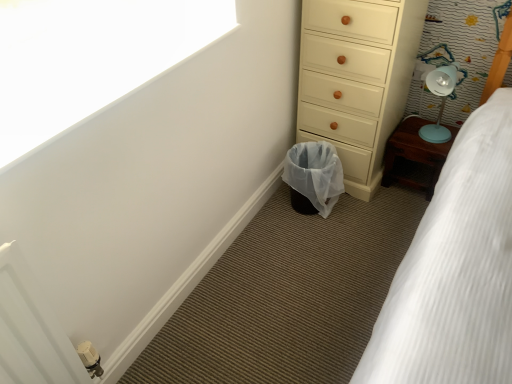
Question: Is white textured bed at lower right inside white matte window screen at upper left?

Choices:
 (A) no
 (B) yes

Answer: (A)

Question: Is white matte window screen at upper left wider than white textured bed at lower right?

Choices:
 (A) yes
 (B) no

Answer: (B)

Question: Is the position of white matte window screen at upper left more distant than that of white textured bed at lower right?

Choices:
 (A) yes
 (B) no

Answer: (A)

Question: From the image's perspective, is white matte window screen at upper left under white textured bed at lower right?

Choices:
 (A) yes
 (B) no

Answer: (B)

Question: Is white matte window screen at upper left located outside white textured bed at lower right?

Choices:
 (A) no
 (B) yes

Answer: (B)

Question: Is white matte window screen at upper left oriented away from white textured bed at lower right?

Choices:
 (A) no
 (B) yes

Answer: (A)

Question: Is white textured bed at lower right thinner than wooden bedside table at right?

Choices:
 (A) yes
 (B) no

Answer: (B)

Question: Is white textured bed at lower right shorter than wooden bedside table at right?

Choices:
 (A) yes
 (B) no

Answer: (B)

Question: Is wooden bedside table at right surrounded by white textured bed at lower right?

Choices:
 (A) no
 (B) yes

Answer: (A)

Question: Is white textured bed at lower right bigger than wooden bedside table at right?

Choices:
 (A) no
 (B) yes

Answer: (B)

Question: Can you confirm if white textured bed at lower right is taller than wooden bedside table at right?

Choices:
 (A) no
 (B) yes

Answer: (B)

Question: Is white textured bed at lower right smaller than wooden bedside table at right?

Choices:
 (A) no
 (B) yes

Answer: (A)

Question: Is white textured bed at lower right a part of wooden bedside table at right?

Choices:
 (A) yes
 (B) no

Answer: (B)